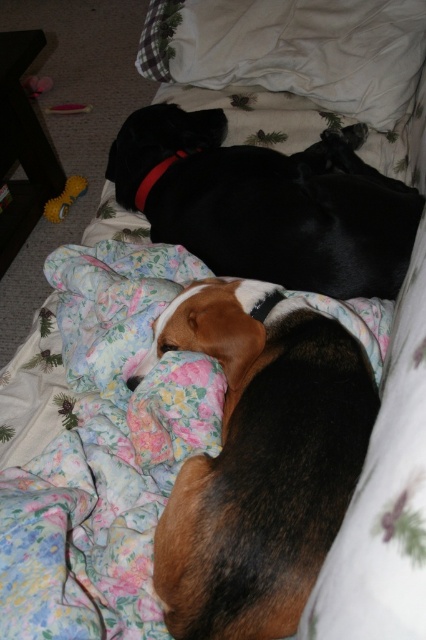
Between brown and black fur at center and black smooth dog at upper center, which one is positioned higher?

Positioned higher is black smooth dog at upper center.

Is brown and black fur at center to the right of black smooth dog at upper center from the viewer's perspective?

Incorrect, brown and black fur at center is not on the right side of black smooth dog at upper center.

Does point (282, 332) come closer to viewer compared to point (253, 266)?

Yes.

Identify the location of brown and black fur at center. (259, 460).

Who is positioned more to the left, brown and black fur at center or white soft pillow at upper center?

brown and black fur at center is more to the left.

Is point (241, 349) closer to camera compared to point (419, 64)?

Yes.

Identify the location of brown and black fur at center. (259, 460).

Who is shorter, black smooth dog at upper center or white soft pillow at upper center?

Standing shorter between the two is white soft pillow at upper center.

Measure the distance between point (362,212) and camera.

Point (362,212) is 1.11 meters away from camera.

This screenshot has height=640, width=426. What are the coordinates of `black smooth dog at upper center` in the screenshot? It's located at (267, 204).